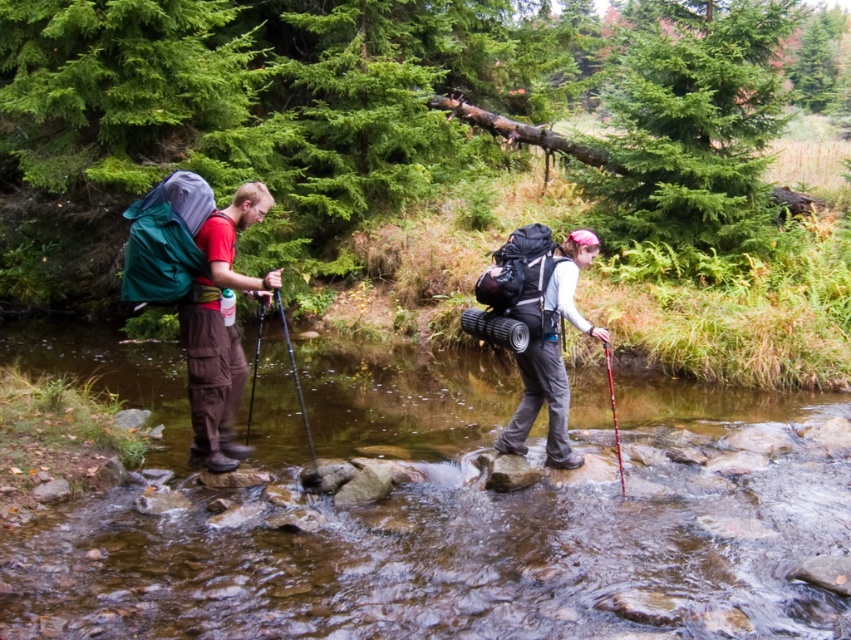
Question: Does matte green backpack at left have a smaller size compared to matte black backpack at center?

Choices:
 (A) no
 (B) yes

Answer: (A)

Question: Is matte green backpack at left thinner than matte black backpack at center?

Choices:
 (A) no
 (B) yes

Answer: (A)

Question: Which point is farther to the camera?

Choices:
 (A) clear water at center
 (B) matte black backpack at center
 (C) matte green backpack at left

Answer: (B)

Question: Is the position of clear water at center more distant than that of matte green backpack at left?

Choices:
 (A) yes
 (B) no

Answer: (B)

Question: Which point is closer to the camera taking this photo?

Choices:
 (A) (223, 346)
 (B) (535, 353)

Answer: (A)

Question: Estimate the real-world distances between objects in this image. Which object is farther from the matte black backpack at center?

Choices:
 (A) matte green backpack at left
 (B) clear water at center

Answer: (A)